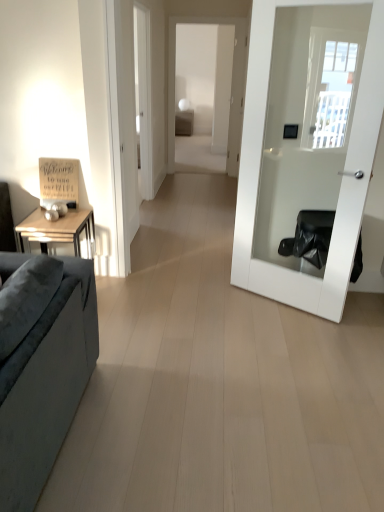
Question: Is suede-like gray couch at left at the left side of white glossy door at right?

Choices:
 (A) no
 (B) yes

Answer: (B)

Question: Would you say suede-like gray couch at left is a long distance from white glossy door at right?

Choices:
 (A) no
 (B) yes

Answer: (B)

Question: Is suede-like gray couch at left directly adjacent to white glossy door at right?

Choices:
 (A) yes
 (B) no

Answer: (B)

Question: From the image's perspective, is suede-like gray couch at left below white glossy door at right?

Choices:
 (A) yes
 (B) no

Answer: (A)

Question: Does suede-like gray couch at left have a lesser width compared to white glossy door at right?

Choices:
 (A) yes
 (B) no

Answer: (B)

Question: Is white glossy door at right located within suede-like gray couch at left?

Choices:
 (A) no
 (B) yes

Answer: (A)

Question: Does suede-like gray couch at left have a greater width compared to matte brown table at center?

Choices:
 (A) no
 (B) yes

Answer: (B)

Question: Is matte brown table at center surrounded by suede-like gray couch at left?

Choices:
 (A) yes
 (B) no

Answer: (B)

Question: From a real-world perspective, is suede-like gray couch at left positioned over matte brown table at center based on gravity?

Choices:
 (A) yes
 (B) no

Answer: (B)

Question: Considering the relative sizes of suede-like gray couch at left and matte brown table at center in the image provided, is suede-like gray couch at left shorter than matte brown table at center?

Choices:
 (A) no
 (B) yes

Answer: (B)

Question: Does suede-like gray couch at left have a larger size compared to matte brown table at center?

Choices:
 (A) no
 (B) yes

Answer: (B)

Question: Is suede-like gray couch at left outside of matte brown table at center?

Choices:
 (A) no
 (B) yes

Answer: (B)

Question: Is matte brown table at center inside white glossy door at right?

Choices:
 (A) yes
 (B) no

Answer: (B)